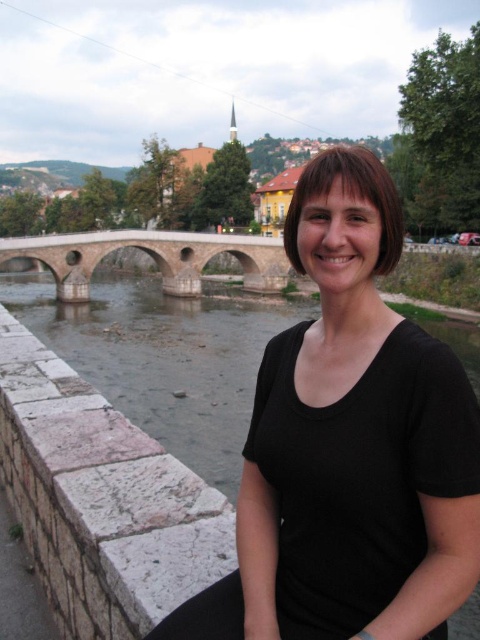
Question: Does black matte shirt at center lie behind gray stone river at center?

Choices:
 (A) no
 (B) yes

Answer: (A)

Question: Can you confirm if gray stone river at center is thinner than stone arch bridge at center?

Choices:
 (A) yes
 (B) no

Answer: (B)

Question: Among these objects, which one is farthest from the camera?

Choices:
 (A) stone arch bridge at center
 (B) black matte shirt at center

Answer: (A)

Question: Among these points, which one is nearest to the camera?

Choices:
 (A) (322, 451)
 (B) (60, 282)
 (C) (27, 326)

Answer: (A)

Question: Is black matte shirt at center closer to the viewer compared to gray stone river at center?

Choices:
 (A) no
 (B) yes

Answer: (B)

Question: Which point is farther to the camera?

Choices:
 (A) coord(96,342)
 (B) coord(71,292)

Answer: (B)